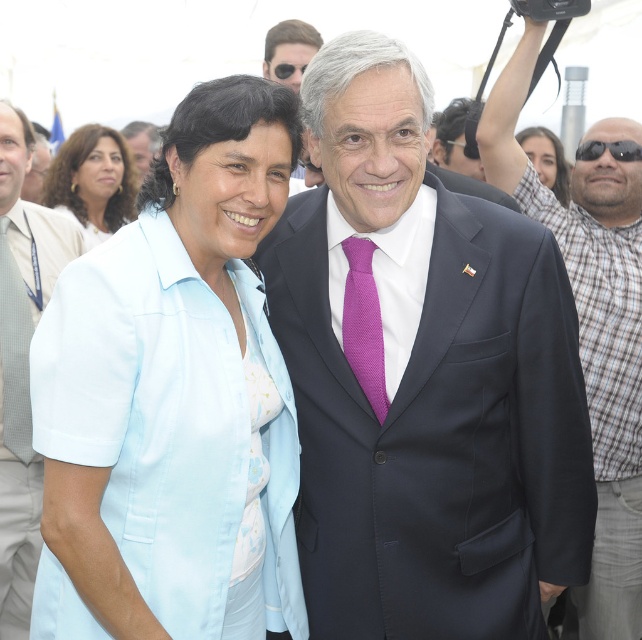
Question: Which point is closer to the camera?

Choices:
 (A) (182, 500)
 (B) (611, 154)
 (C) (499, 90)
 (D) (349, 298)

Answer: (A)

Question: From the image, what is the correct spatial relationship of matte white blouse at upper left in relation to matte black hair at upper right?

Choices:
 (A) right
 (B) left

Answer: (B)

Question: Does white cotton shirt at left appear on the left side of sunglasses at right?

Choices:
 (A) yes
 (B) no

Answer: (A)

Question: Which object is closer to the camera taking this photo?

Choices:
 (A) sunglasses at right
 (B) purple textured tie at center
 (C) dark blue suit at right
 (D) light blue fabric shirt at center

Answer: (D)

Question: Does light blue fabric shirt at center have a greater width compared to matte black suit at center?

Choices:
 (A) yes
 (B) no

Answer: (B)

Question: Which point is closer to the camera?

Choices:
 (A) matte white blouse at upper left
 (B) matte black suit at center
 (C) white cotton shirt at left

Answer: (C)